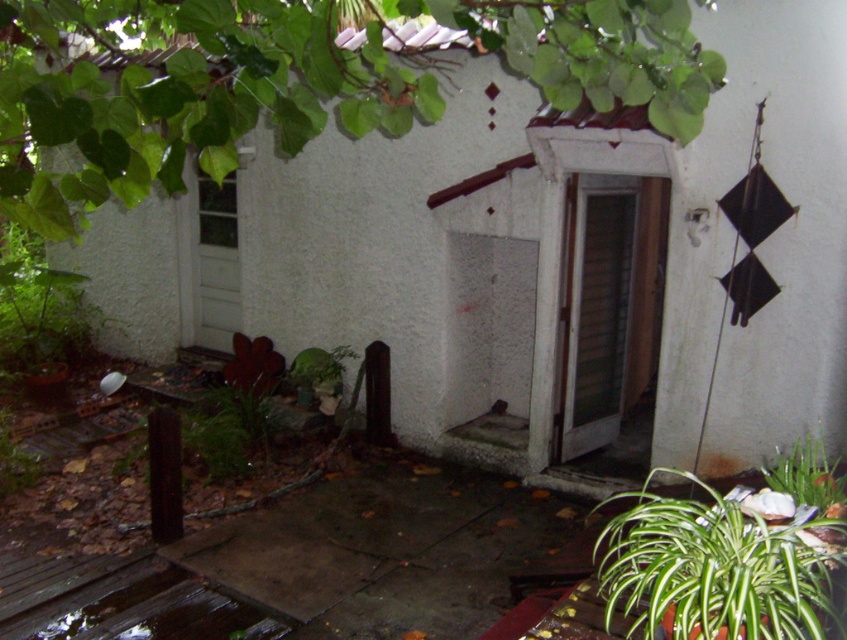
Question: Is green leafy tree at upper center wider than green leafy plant at lower right?

Choices:
 (A) yes
 (B) no

Answer: (A)

Question: Which point is closer to the camera taking this photo?

Choices:
 (A) (296, 84)
 (B) (630, 493)

Answer: (A)

Question: Is the position of green leafy tree at upper center more distant than that of green leafy plant at lower right?

Choices:
 (A) no
 (B) yes

Answer: (A)

Question: Among these objects, which one is farthest from the camera?

Choices:
 (A) green leafy plant at lower right
 (B) green leafy tree at upper center

Answer: (A)

Question: Is green leafy tree at upper center in front of green leafy plant at lower right?

Choices:
 (A) yes
 (B) no

Answer: (A)

Question: Which point is farther to the camera?

Choices:
 (A) green leafy tree at upper center
 (B) green leafy plant at lower right

Answer: (B)